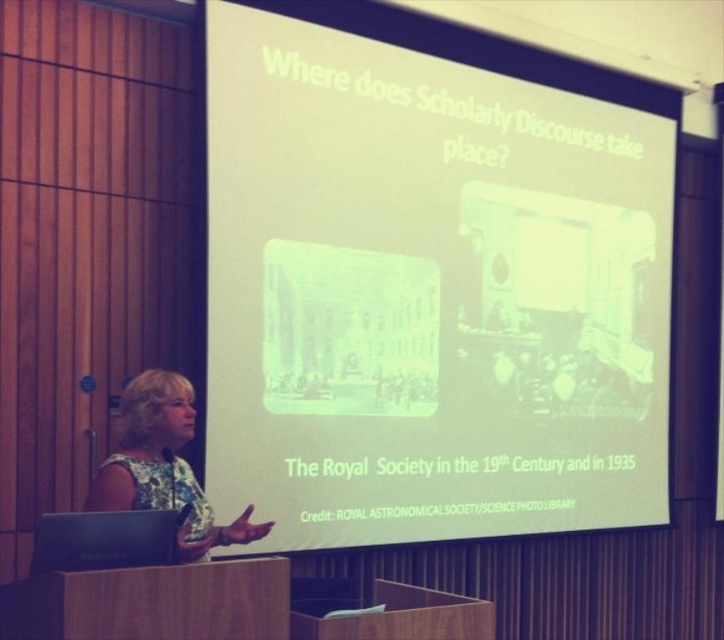
Does white matte projection screen at upper center appear over floral fabric dress at lower left?

Indeed, white matte projection screen at upper center is positioned over floral fabric dress at lower left.

Can you confirm if white matte projection screen at upper center is taller than floral fabric dress at lower left?

Yes.

Which is behind, point (294, 340) or point (181, 477)?

The point (294, 340) is behind.

Where is `white matte projection screen at upper center`? white matte projection screen at upper center is located at coordinates 429,282.